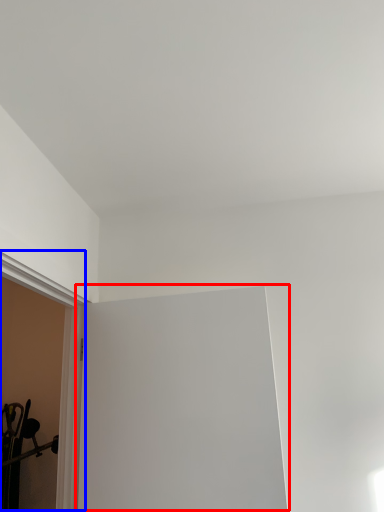
Question: Which object appears closest to the camera in this image, window screen (highlighted by a red box) or window sill (highlighted by a blue box)?

Choices:
 (A) window screen
 (B) window sill

Answer: (B)